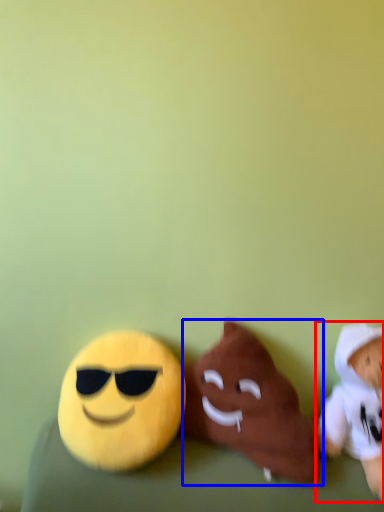
Question: Which object is further to the camera taking this photo, toy (highlighted by a red box) or toy (highlighted by a blue box)?

Choices:
 (A) toy
 (B) toy

Answer: (B)